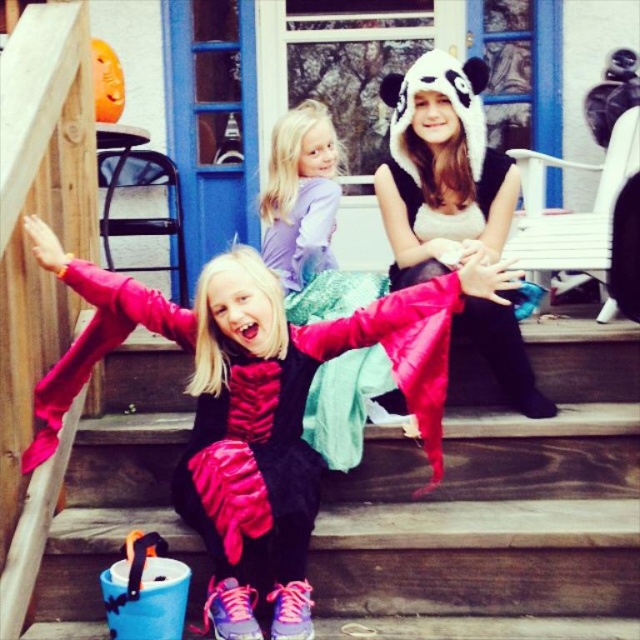
Does wooden stairs at lower center have a greater height compared to purple satin dress at center?

A: Indeed, wooden stairs at lower center has a greater height compared to purple satin dress at center.

Who is more distant from viewer, (618, 420) or (317, 134)?

The point (317, 134) is behind.

Describe the element at coordinates (497, 506) in the screenshot. This screenshot has width=640, height=640. I see `wooden stairs at lower center` at that location.

Find the location of a particular element. wooden stairs at lower center is located at coordinates (497, 506).